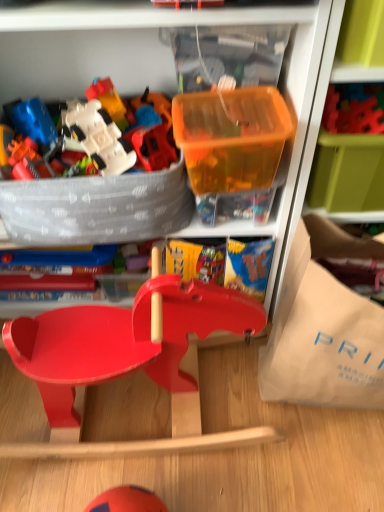
Question: Is translucent plastic container at upper right facing towards white plastic spaceship at upper left, the 1th toy from the left?

Choices:
 (A) yes
 (B) no

Answer: (B)

Question: Can you confirm if translucent plastic container at upper right is taller than white plastic spaceship at upper left, the 2th toy when ordered from top to bottom?

Choices:
 (A) no
 (B) yes

Answer: (B)

Question: From a real-world perspective, is translucent plastic container at upper right positioned over white plastic spaceship at upper left, acting as the 1th toy starting from the bottom, based on gravity?

Choices:
 (A) no
 (B) yes

Answer: (A)

Question: From the image's perspective, is translucent plastic container at upper right over white plastic spaceship at upper left, positioned as the 2th toy in right-to-left order?

Choices:
 (A) yes
 (B) no

Answer: (A)

Question: Can white plastic spaceship at upper left, acting as the 1th toy starting from the bottom, be found inside translucent plastic container at upper right?

Choices:
 (A) no
 (B) yes

Answer: (A)

Question: Are translucent plastic container at upper right and white plastic spaceship at upper left, positioned as the 2th toy in right-to-left order, located far from each other?

Choices:
 (A) yes
 (B) no

Answer: (B)

Question: From the image's perspective, is smooth plastic toy at center, the 2th toy when ordered from bottom to top, on top of smooth red wooden baby carriage at center?

Choices:
 (A) no
 (B) yes

Answer: (B)

Question: Considering the relative sizes of smooth plastic toy at center, which is the 1th toy from right to left, and smooth red wooden baby carriage at center in the image provided, is smooth plastic toy at center, which is the 1th toy from right to left, shorter than smooth red wooden baby carriage at center?

Choices:
 (A) yes
 (B) no

Answer: (A)

Question: Can you confirm if smooth plastic toy at center, the 2th toy viewed from the left, is thinner than smooth red wooden baby carriage at center?

Choices:
 (A) yes
 (B) no

Answer: (A)

Question: Is smooth plastic toy at center, the 2th toy when ordered from bottom to top, not close to smooth red wooden baby carriage at center?

Choices:
 (A) no
 (B) yes

Answer: (A)

Question: Is smooth plastic toy at center, the 2th toy viewed from the left, in contact with smooth red wooden baby carriage at center?

Choices:
 (A) yes
 (B) no

Answer: (B)

Question: From a real-world perspective, is smooth plastic toy at center, acting as the 1th toy starting from the top, located higher than smooth red wooden baby carriage at center?

Choices:
 (A) no
 (B) yes

Answer: (B)

Question: Is translucent plastic container at upper right aimed at translucent orange plastic container at upper center?

Choices:
 (A) no
 (B) yes

Answer: (A)